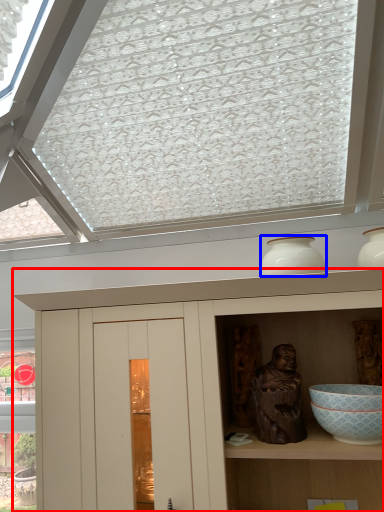
Question: Which object appears farthest to the camera in this image, cupboard (highlighted by a red box) or vase (highlighted by a blue box)?

Choices:
 (A) cupboard
 (B) vase

Answer: (B)